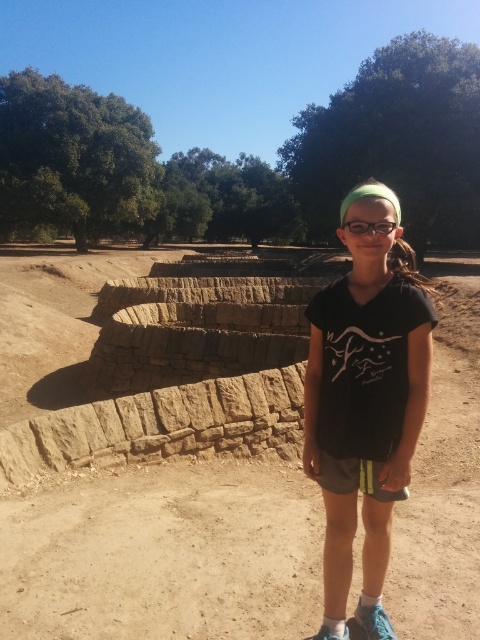
You are standing at the point with coordinates point (325, 602) and want to walk to the point with coordinates point (393, 588). Given that the path between them is 1.5 meters wide, can your 1.2 meter wide backpack fit through?

Point (393, 588) is behind point (325, 602). Since the path between them is 1.5 meters wide, your 1.2 meter wide backpack can fit through as it is narrower than the path width.